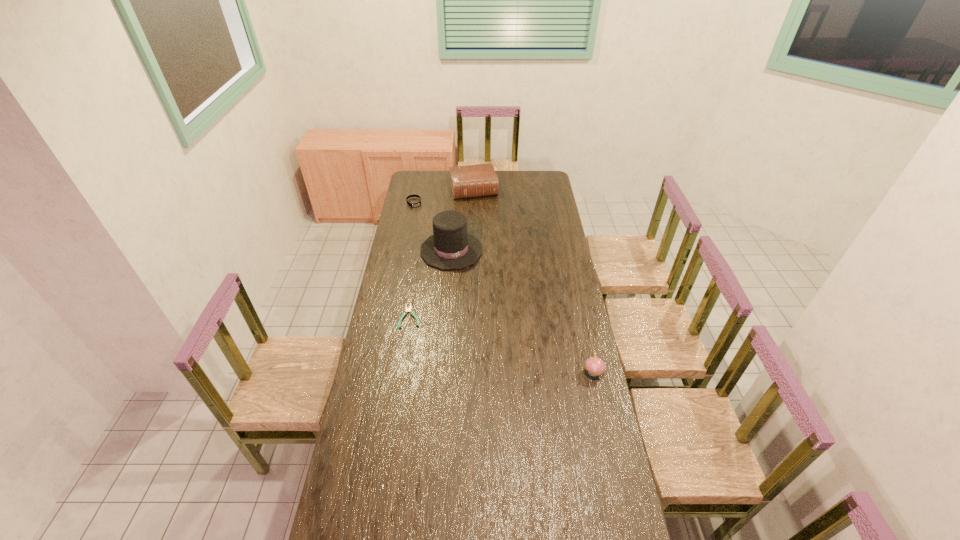
The width and height of the screenshot is (960, 540). What are the coordinates of `free space between the tallest object and the pliers` in the screenshot? It's located at (431, 284).

Where is `free spot between the third farthest object and the pliers`? This screenshot has width=960, height=540. free spot between the third farthest object and the pliers is located at coordinates (431, 284).

This screenshot has height=540, width=960. What are the coordinates of `vacant space in between the tallest object and the wristband` in the screenshot? It's located at (433, 226).

The height and width of the screenshot is (540, 960). Find the location of `empty space between the fourth farthest object and the third nearest object`. empty space between the fourth farthest object and the third nearest object is located at coordinates (431, 284).

Locate an element on the screen. free space between the wristband and the tallest object is located at coordinates (433, 226).

This screenshot has width=960, height=540. I want to click on vacant area that lies between the second shortest object and the Bible, so click(444, 196).

The height and width of the screenshot is (540, 960). I want to click on object that is the third closest to the second nearest object, so click(419, 203).

Choose which object is the second nearest neighbor to the rightmost object. Please provide its 2D coordinates. Your answer should be formatted as a tuple, i.e. [(x, y)], where the tuple contains the x and y coordinates of a point satisfying the conditions above.

[(407, 309)]

Identify the location of blank area in the image that satisfies the following two spatial constraints: 1. on the back side of the fourth farthest object; 2. on the right side of the tallest object. Image resolution: width=960 pixels, height=540 pixels. coord(420,251).

Locate an element on the screen. The height and width of the screenshot is (540, 960). vacant position in the image that satisfies the following two spatial constraints: 1. on the front side of the rightmost object; 2. on the left side of the wristband is located at coordinates (380, 372).